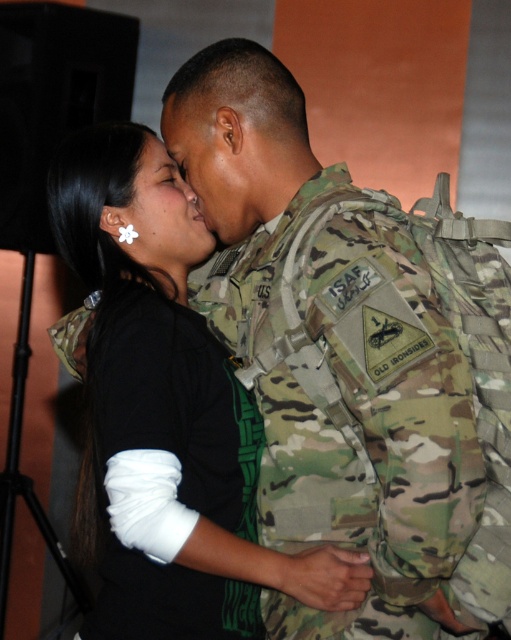
Is point (228, 154) positioned in front of point (155, 186)?

Yes, point (228, 154) is in front of point (155, 186).

Which of these two, matte military uniform at center or white flower at center, stands taller?

white flower at center

Does point (207, 218) lie in front of point (178, 269)?

Yes.

This screenshot has width=511, height=640. I want to click on matte military uniform at center, so click(210, 160).

Between black matte shirt at center and camo fabric uniform at center, which one appears on the right side from the viewer's perspective?

camo fabric uniform at center

In the scene shown: Is black matte shirt at center above camo fabric uniform at center?

Yes.

Describe the element at coordinates (167, 412) in the screenshot. Image resolution: width=511 pixels, height=640 pixels. I see `black matte shirt at center` at that location.

The width and height of the screenshot is (511, 640). I want to click on black matte shirt at center, so click(167, 412).

Is camo fabric uniform at center wider than white flower at center?

Correct, the width of camo fabric uniform at center exceeds that of white flower at center.

Is camo fabric uniform at center behind white flower at center?

That is False.

What are the coordinates of `camo fabric uniform at center` in the screenshot? It's located at (177, 458).

This screenshot has height=640, width=511. Find the location of `camo fabric uniform at center`. camo fabric uniform at center is located at coordinates (177, 458).